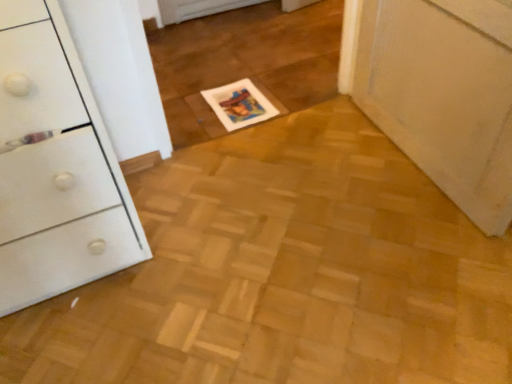
Where is `free space above white glossy magazine at center (from a real-world perspective)`? The image size is (512, 384). free space above white glossy magazine at center (from a real-world perspective) is located at coordinates pos(236,98).